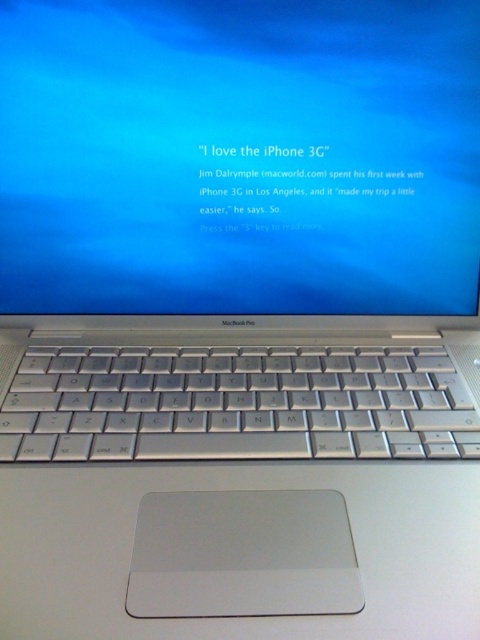
Question: Which of the following is the farthest from the observer?

Choices:
 (A) satin silver screen at center
 (B) silver metallic keyboard at center

Answer: (A)

Question: Where is satin silver screen at center located in relation to silver metallic keyboard at center in the image?

Choices:
 (A) left
 (B) right

Answer: (B)

Question: Is satin silver screen at center above silver metallic keyboard at center?

Choices:
 (A) yes
 (B) no

Answer: (A)

Question: Is satin silver screen at center bigger than silver metallic keyboard at center?

Choices:
 (A) no
 (B) yes

Answer: (B)